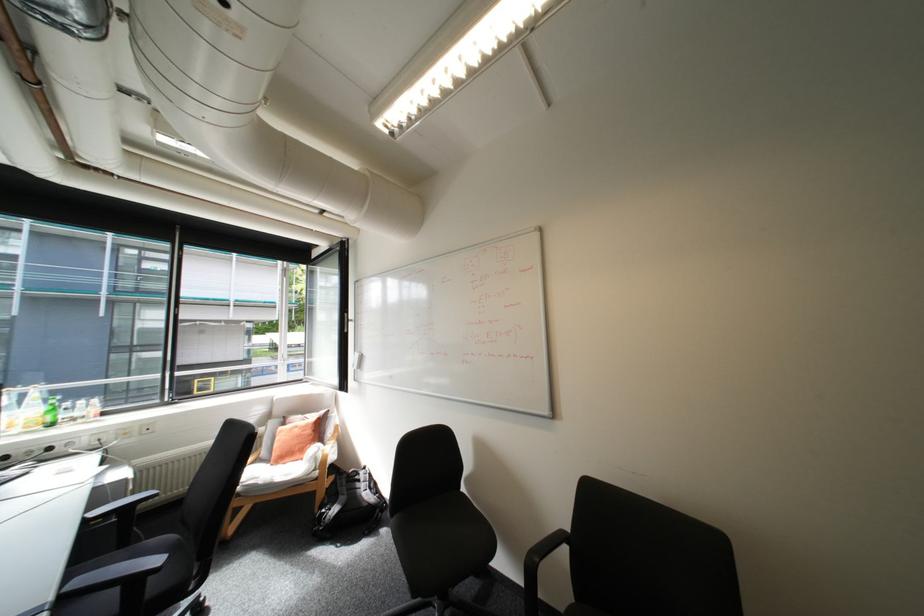
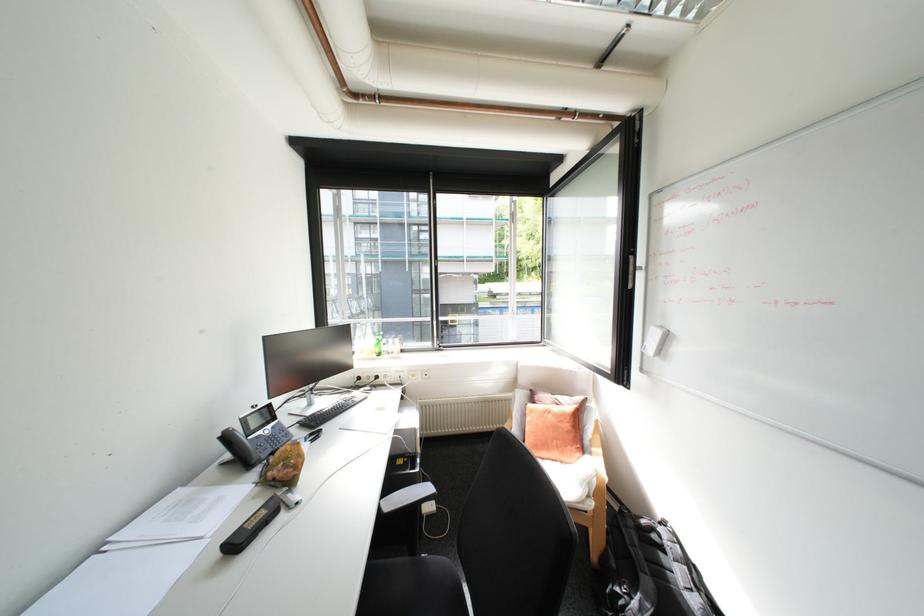
Where in the second image is the point corresponding to [339,509] from the first image?

(640, 598)